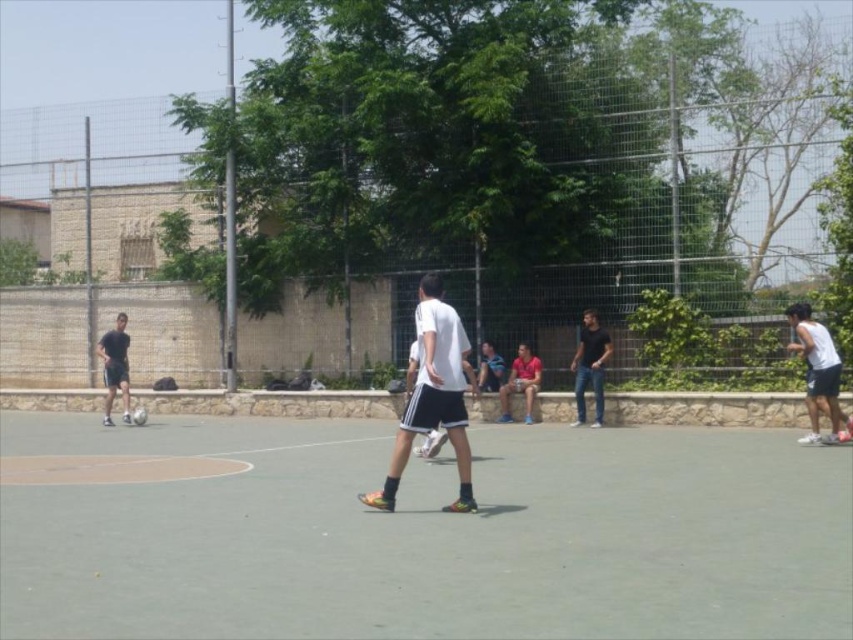
You are a soccer player trying to position yourself between the green rubber court at center and the matte red shirt at center. Which object should you move towards to be closer to the center of the court?

You should move towards the matte red shirt at center because it is smaller and positioned closer to the center of the court compared to the green rubber court at center.

You are a photographer standing at the edge of the court. You want to take a photo that includes both the green rubber court at center and the matte red shirt at center. Which object should you focus on first to ensure both are in sharp focus?

You should focus on the green rubber court at center first because it is closer to the viewer than the matte red shirt at center. By focusing on the closer object, the farther object will also be in focus due to the depth of field.